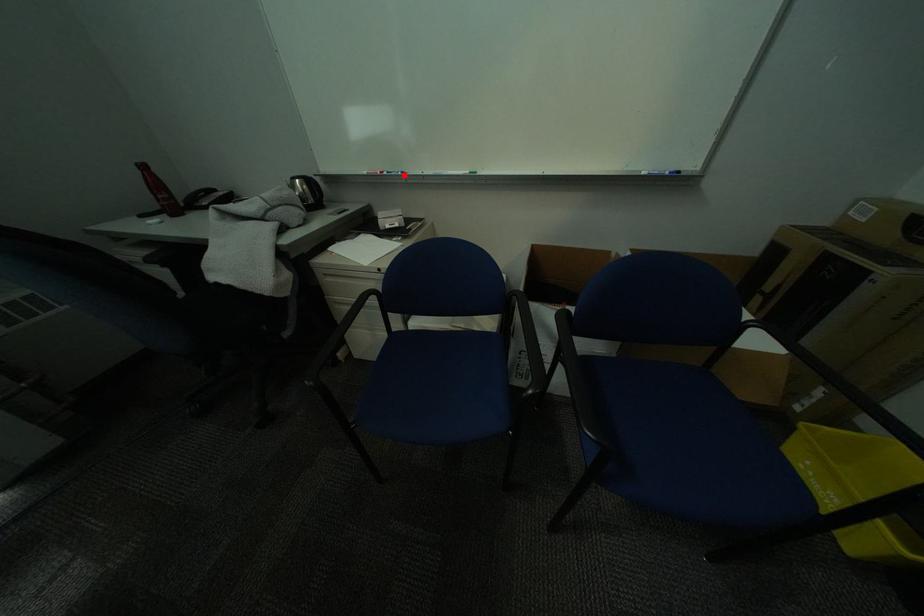
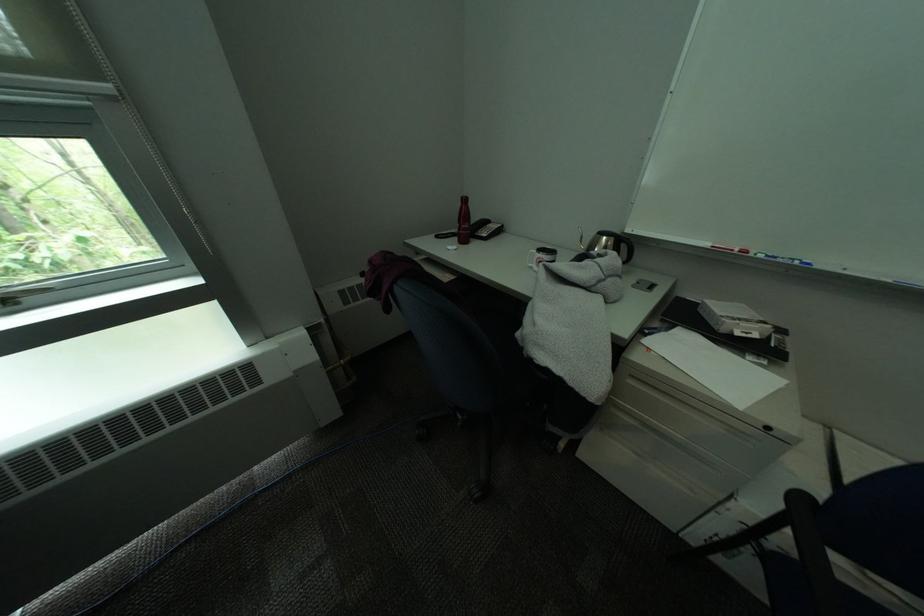
Find the pixel in the second image that matches the highlighted location in the first image.

(791, 262)